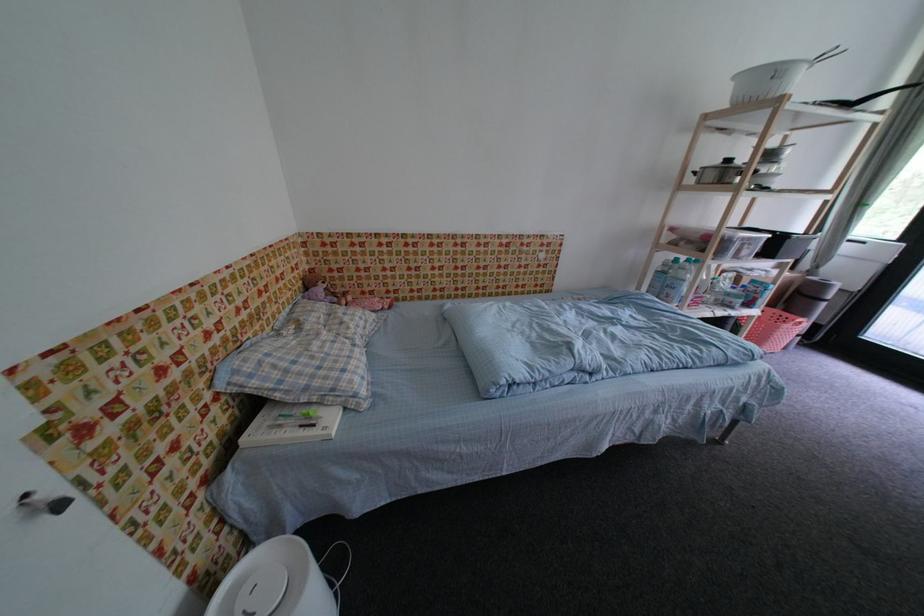
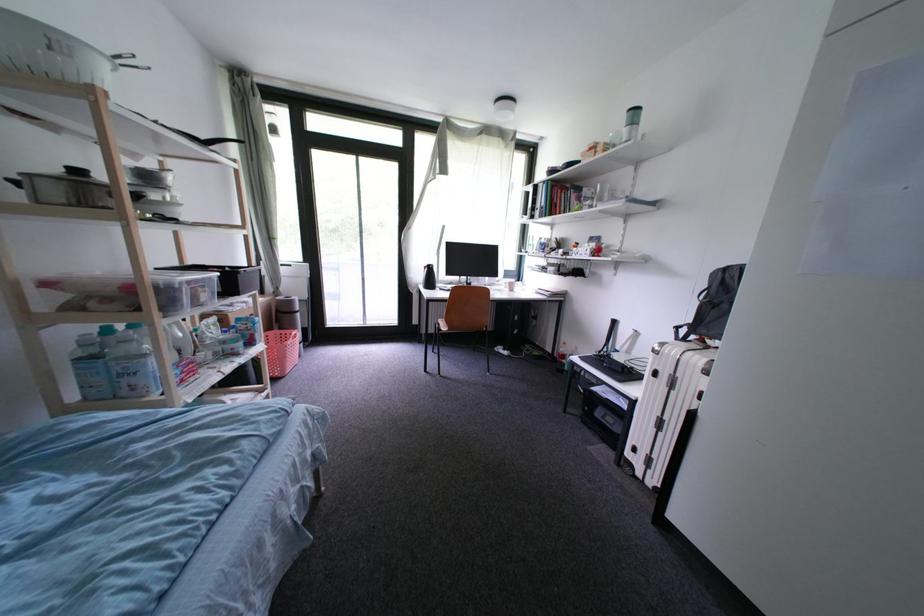
The images are taken continuously from a first-person perspective. In which direction is your viewpoint rotating?

The camera's rotation is toward right-down.